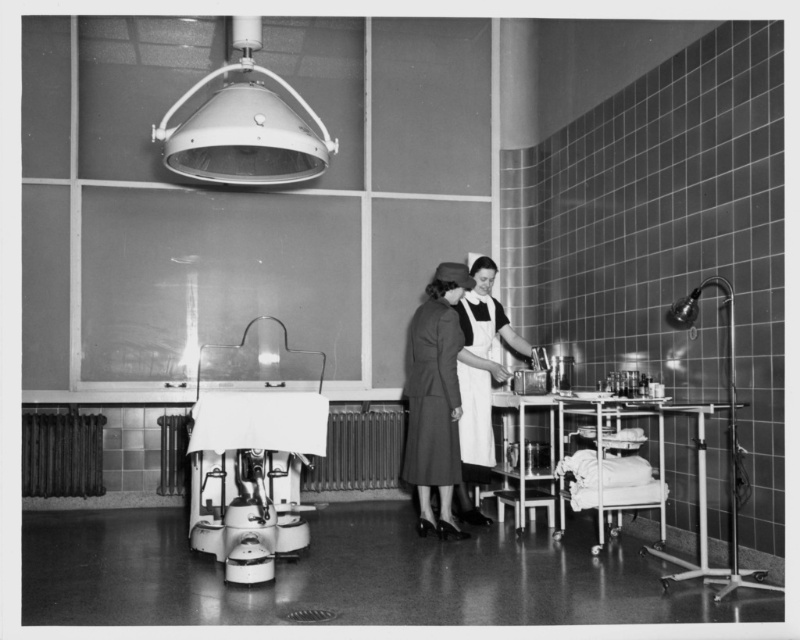
You are a nurse in this operating room and need to determine which garment is narrower between the dark gray fabric coat at center and the white apron at center. Which one should you choose?

The dark gray fabric coat at center has a lesser width compared to the white apron at center, so you should choose the dark gray fabric coat at center as it is narrower.

You are a surgeon in the operating room. You need to reach both the point at coordinates point (x=222, y=156) and point (x=472, y=323). Which point should you move towards first to reach the closer one?

Point point (x=222, y=156) is closer to the camera than point point (x=472, y=323), so you should move towards point point (x=222, y=156) first.